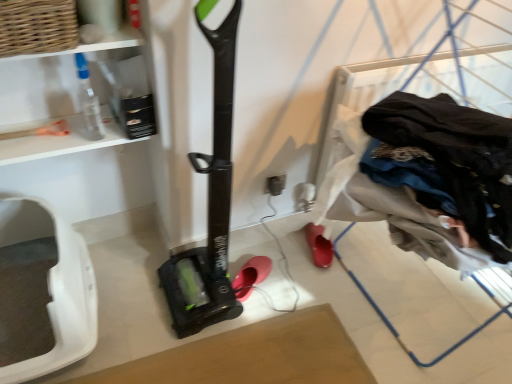
Question: Does woven brown basket at upper left appear on the left side of matte gray electric outlet at center?

Choices:
 (A) no
 (B) yes

Answer: (B)

Question: Could you tell me if woven brown basket at upper left is turned towards matte gray electric outlet at center?

Choices:
 (A) no
 (B) yes

Answer: (A)

Question: Considering the relative sizes of woven brown basket at upper left and matte gray electric outlet at center in the image provided, is woven brown basket at upper left thinner than matte gray electric outlet at center?

Choices:
 (A) no
 (B) yes

Answer: (A)

Question: Does woven brown basket at upper left have a greater height compared to matte gray electric outlet at center?

Choices:
 (A) yes
 (B) no

Answer: (A)

Question: From the image's perspective, is woven brown basket at upper left located above matte gray electric outlet at center?

Choices:
 (A) yes
 (B) no

Answer: (A)

Question: Looking at the image, does white plastic pet carrier at lower left seem bigger or smaller compared to translucent plastic bottle at upper left?

Choices:
 (A) big
 (B) small

Answer: (A)

Question: From the image's perspective, is white plastic pet carrier at lower left located above or below translucent plastic bottle at upper left?

Choices:
 (A) below
 (B) above

Answer: (A)

Question: Is white plastic pet carrier at lower left inside or outside of translucent plastic bottle at upper left?

Choices:
 (A) outside
 (B) inside

Answer: (A)

Question: Considering the positions of point (68, 292) and point (129, 54), is point (68, 292) closer or farther from the camera than point (129, 54)?

Choices:
 (A) farther
 (B) closer

Answer: (B)

Question: From their relative heights in the image, would you say woven brown basket at upper left is taller or shorter than rubberized red shoe at lower center, marked as the second footwear in a left-to-right arrangement?

Choices:
 (A) tall
 (B) short

Answer: (A)

Question: Would you say woven brown basket at upper left is to the left or to the right of rubberized red shoe at lower center, marked as the second footwear in a left-to-right arrangement, in the picture?

Choices:
 (A) left
 (B) right

Answer: (A)

Question: In terms of size, does woven brown basket at upper left appear bigger or smaller than rubberized red shoe at lower center, acting as the 1th footwear starting from the right?

Choices:
 (A) big
 (B) small

Answer: (A)

Question: Which is correct: woven brown basket at upper left is inside rubberized red shoe at lower center, acting as the 1th footwear starting from the right, or outside of it?

Choices:
 (A) inside
 (B) outside

Answer: (B)

Question: Considering their positions, is woven brown basket at upper left located in front of or behind translucent plastic bottle at upper left?

Choices:
 (A) front
 (B) behind

Answer: (A)

Question: From the image's perspective, is woven brown basket at upper left located above or below translucent plastic bottle at upper left?

Choices:
 (A) above
 (B) below

Answer: (A)